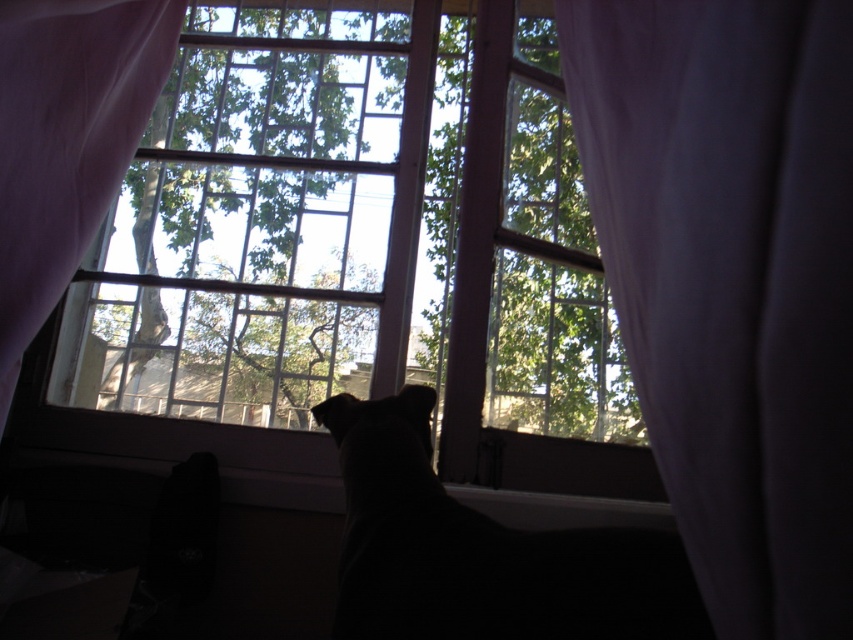
You are trying to decide whether to open the clear glass window at center for fresh air. Considering the size of the white sheer curtain at left, will the curtain block the window when you open it?

The clear glass window at center is bigger than the white sheer curtain at left, so when you open the window, the curtain may still hang loosely but won generated question and answer based on the provided information. 1. Question must be related to the description. 2. The question must mention both objects. 3. The answer must reference the object description. 4. The answer must be concise and factual. 5. The question should be from an observer perspective. 6. Do not reveal the specific details in the

You are standing in the room and see the point marked at coordinates [352,253]. Based on the scene description, can you determine if this point is on the clear glass window at center or behind the sheer purple curtains?

The point at coordinates [352,253] is on the clear glass window at center, as stated in the objects description.